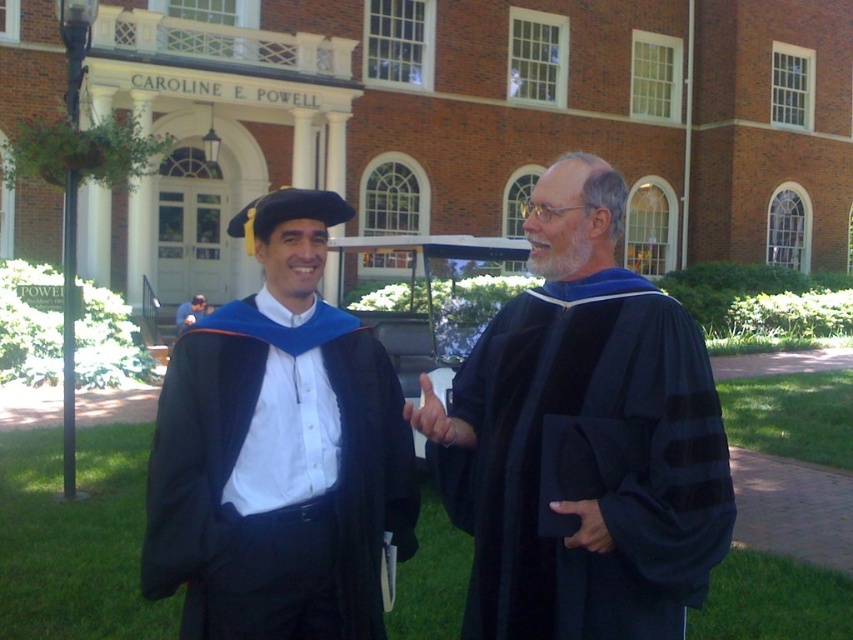
Can you confirm if black matte graduation gown at center is taller than matte black robe at center?

Indeed, black matte graduation gown at center has a greater height compared to matte black robe at center.

Which is more to the left, black matte graduation gown at center or matte black robe at center?

matte black robe at center is more to the left.

Does point (601, 314) come in front of point (360, 522)?

Yes, it is in front of point (360, 522).

You are a GUI agent. You are given a task and a screenshot of the screen. Output one action in this format:
    pyautogui.click(x=<x>, y=<y>)
    Task: Click on the black matte graduation gown at center
    
    Given the screenshot: What is the action you would take?
    pyautogui.click(x=583, y=438)